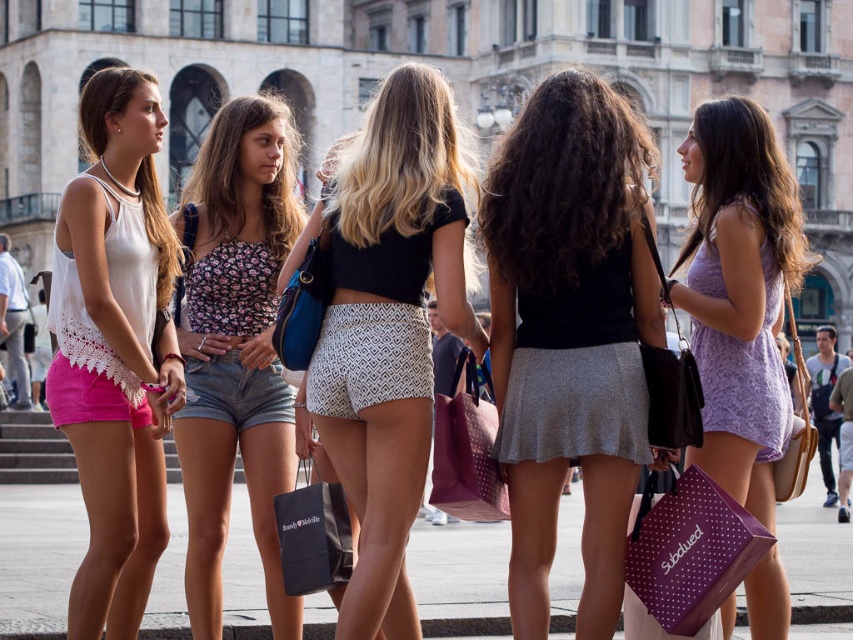
Question: Which point is closer to the camera taking this photo?

Choices:
 (A) (808, 253)
 (B) (328, 252)
 (C) (340, 508)
 (D) (509, 362)

Answer: (C)

Question: Which point is farther to the camera?

Choices:
 (A) white textured shorts at center
 (B) floral fabric top at center
 (C) purple dotted paper shopping bag at lower right

Answer: (B)

Question: Is matte white tank top at left smaller than matte black shopping bag at center?

Choices:
 (A) yes
 (B) no

Answer: (B)

Question: Based on their relative distances, which object is nearer to the dark brown curly hair at center?

Choices:
 (A) floral fabric top at center
 (B) matte black shopping bag at center

Answer: (B)

Question: Is floral fabric top at center bigger than lavender fabric dress at center?

Choices:
 (A) yes
 (B) no

Answer: (B)

Question: Does white textured shorts at center appear under lavender printed dress at right?

Choices:
 (A) yes
 (B) no

Answer: (A)